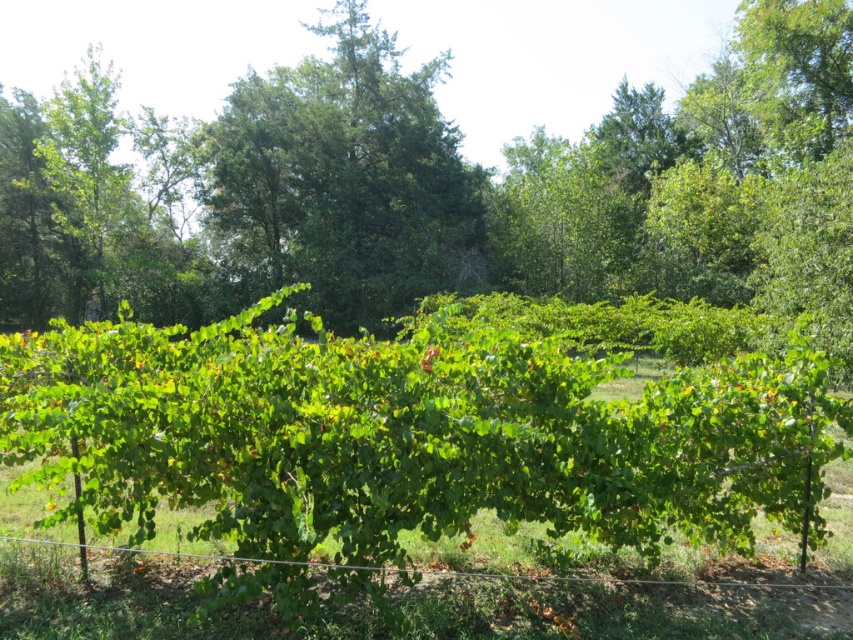
Is green leafy bush at center further to camera compared to green leafy tree at center?

No, it is in front of green leafy tree at center.

The height and width of the screenshot is (640, 853). Identify the location of green leafy bush at center. (439, 188).

Consider the image. Which is more to the right, green leafy tree at center or wire at lower center?

From the viewer's perspective, wire at lower center appears more on the right side.

Is the position of green leafy tree at center more distant than that of wire at lower center?

Yes, it is.

Is point (351, 124) farther from camera compared to point (744, 572)?

That is True.

I want to click on green leafy tree at center, so click(x=344, y=179).

Between green leafy bush at center and wire at lower center, which one appears on the left side from the viewer's perspective?

Positioned to the left is green leafy bush at center.

The image size is (853, 640). In order to click on green leafy bush at center in this screenshot , I will do `click(439, 188)`.

Is point (322, 177) farther from camera compared to point (613, 616)?

Yes, it is behind point (613, 616).

The width and height of the screenshot is (853, 640). What are the coordinates of `green leafy bush at center` in the screenshot? It's located at (439, 188).